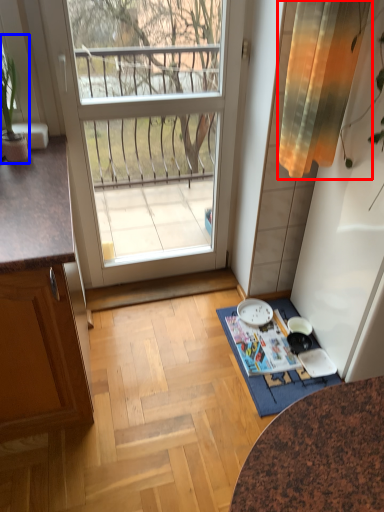
Question: Which of the following is the closest to the observer, curtain (highlighted by a red box) or houseplant (highlighted by a blue box)?

Choices:
 (A) curtain
 (B) houseplant

Answer: (A)